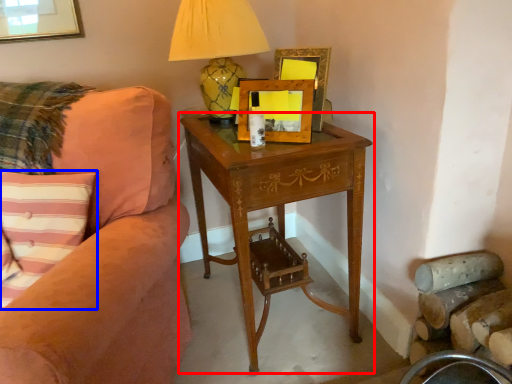
Question: Which of the following is the closest to the observer, nightstand (highlighted by a red box) or pillow (highlighted by a blue box)?

Choices:
 (A) nightstand
 (B) pillow

Answer: (B)